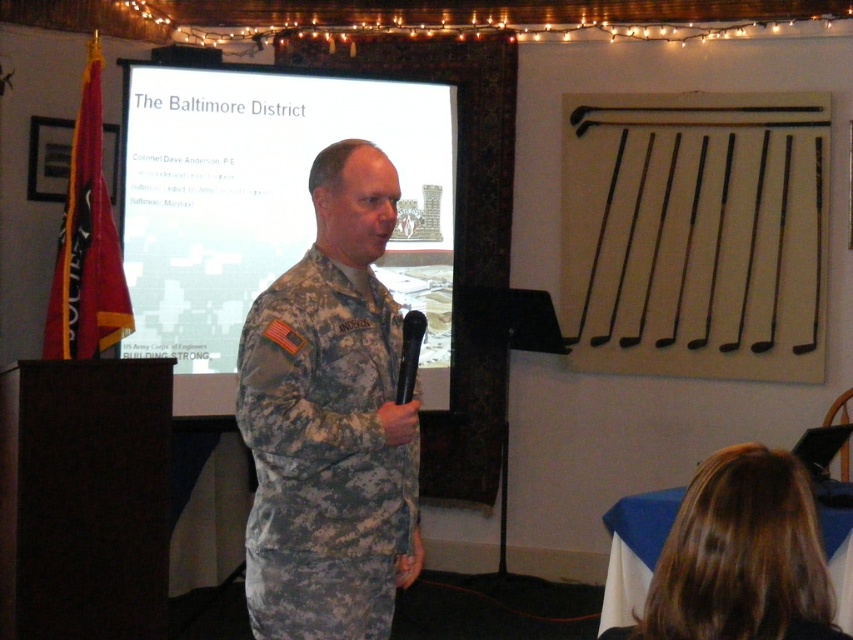
Based on the scene description, which object is positioned to the left of the other? The white matte projection screen at center or the camouflage uniform at center?

The white matte projection screen at center is to the left of the camouflage uniform at center.

You are a photographer setting up for a presentation. You need to place a small prop between the two points labeled point (x=283, y=596) and point (x=647, y=634). Which point should you position the prop closer to so that it appears larger in the photo?

To make the prop appear larger in the photo, place it closer to point (x=647, y=634) because it is closer to the camera than point (x=283, y=596).